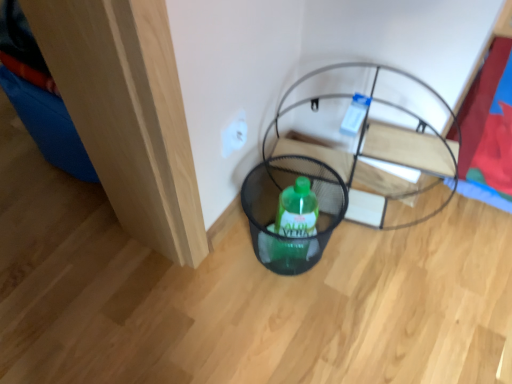
Question: From the image's perspective, relative to white plastic electric outlet at center, is black mesh basket at center above or below?

Choices:
 (A) below
 (B) above

Answer: (A)

Question: Would you say black mesh basket at center is to the left or to the right of white plastic electric outlet at center in the picture?

Choices:
 (A) right
 (B) left

Answer: (A)

Question: Which object is positioned farthest from the black mesh basket at center?

Choices:
 (A) white plastic electric outlet at center
 (B) black mesh basket at lower center

Answer: (A)

Question: Which of these objects is positioned closest to the black mesh basket at lower center?

Choices:
 (A) white plastic electric outlet at center
 (B) black mesh basket at center

Answer: (B)